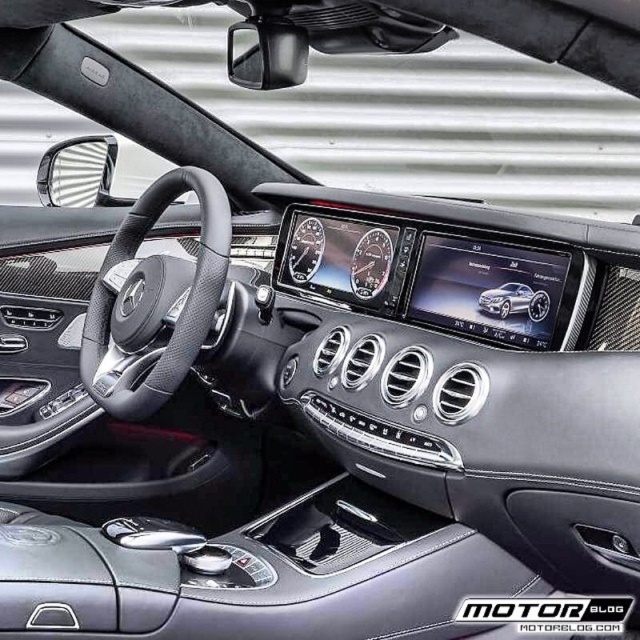
You are a car designer evaluating the interior of a luxury vehicle. You notice the black leather steering wheel at center and the satin silver metallic car at center. Which object has a greater width?

The black leather steering wheel at center has a greater width than the satin silver metallic car at center according to the description.

You are a car designer evaluating the interior of a luxury vehicle. You notice the black leather steering wheel at center and the satin silver metallic car at center. Which object is taller in the image?

The black leather steering wheel at center is taller than the satin silver metallic car at center.

You are a car designer evaluating the interior of a luxury vehicle. You notice the black leather steering wheel at center and the satin silver metallic car at center. Which object is bigger in size?

The black leather steering wheel at center has a larger size compared to the satin silver metallic car at center.